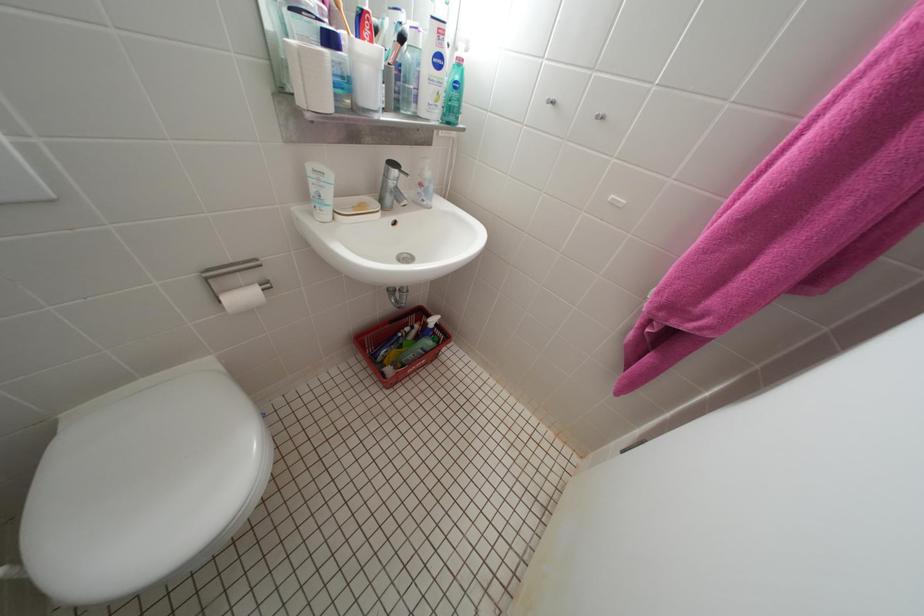
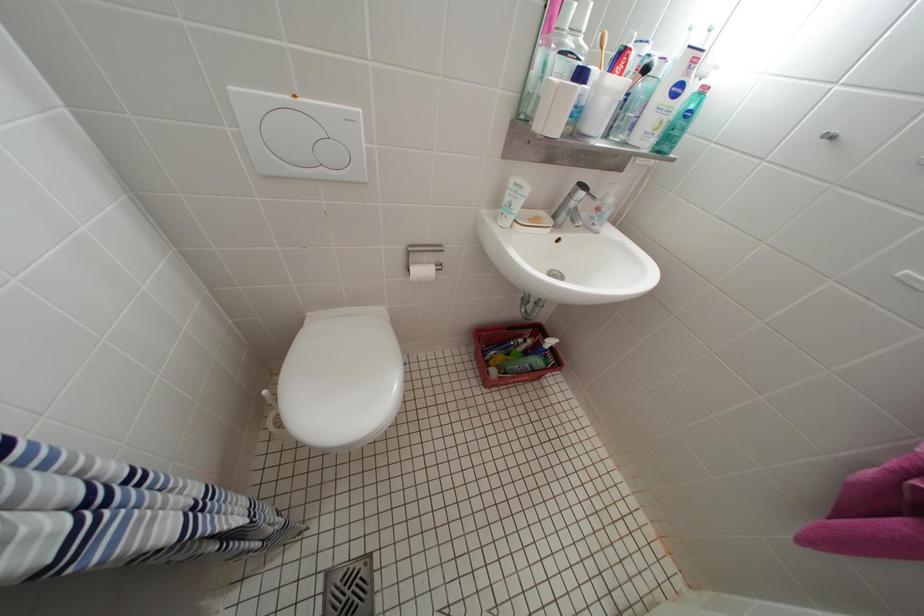
In a continuous first-person perspective shot, in which direction is the camera moving?

The movement direction of the cameraman is left, backward.